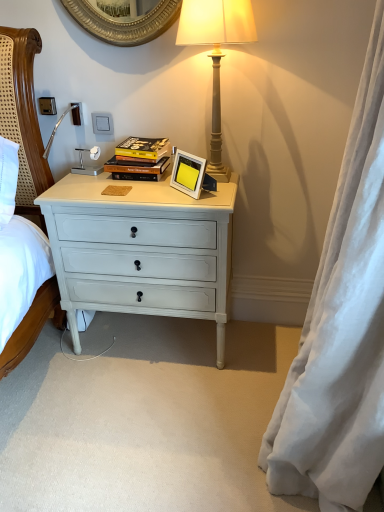
Question: From a real-world perspective, is white silky curtain at right above or below white plastic power outlet at upper left, arranged as the 2th power outlet when viewed from the left?

Choices:
 (A) below
 (B) above

Answer: (A)

Question: Based on their positions, is white silky curtain at right located to the left or right of white plastic power outlet at upper left, arranged as the second power outlet when viewed from the right?

Choices:
 (A) left
 (B) right

Answer: (B)

Question: Which is farther from the hardcover book at center?

Choices:
 (A) white silky curtain at right
 (B) white plastic power outlet at upper left, arranged as the second power outlet when viewed from the right
 (C) satin silver power outlet at upper left, which is the 1th power outlet from left to right
 (D) white painted wood drawer at center
 (E) matte beige lamp at upper right

Answer: (A)

Question: Based on their relative distances, which object is farther from the hardcover book at center?

Choices:
 (A) white plastic power outlet at upper left, arranged as the second power outlet when viewed from the right
 (B) white plastic power outlet at upper left, acting as the 1th power outlet starting from the right
 (C) white painted wood drawer at center
 (D) matte beige lamp at upper right
 (E) white silky curtain at right

Answer: (E)